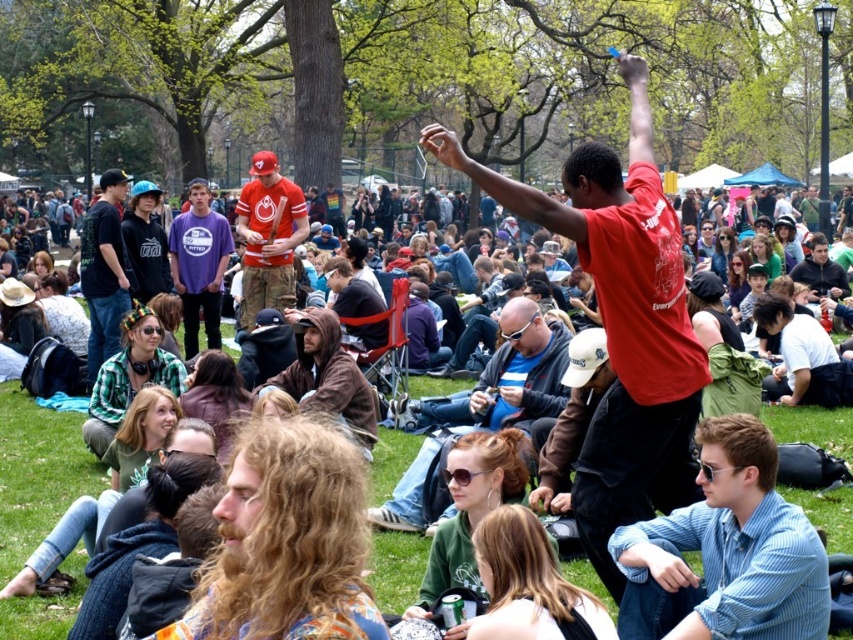
Can you confirm if matte brown leather jacket at center is thinner than matte black jacket at left?

Yes.

Measure the distance from matte brown leather jacket at center to matte black jacket at left.

A distance of 10.70 meters exists between matte brown leather jacket at center and matte black jacket at left.

Find the location of a particular element. This screenshot has height=640, width=853. matte brown leather jacket at center is located at coordinates (520, 371).

Find the location of a particular element. matte brown leather jacket at center is located at coordinates (520, 371).

Does matte brown leather jacket at center appear under purple cotton shirt at center?

Indeed, matte brown leather jacket at center is positioned under purple cotton shirt at center.

Which is more to the left, matte brown leather jacket at center or purple cotton shirt at center?

purple cotton shirt at center is more to the left.

Identify the location of matte brown leather jacket at center. (520, 371).

Image resolution: width=853 pixels, height=640 pixels. I want to click on matte brown leather jacket at center, so click(520, 371).

Is matte red shirt at center shorter than matte brown leather jacket at center?

No.

What do you see at coordinates (619, 323) in the screenshot? I see `matte red shirt at center` at bounding box center [619, 323].

This screenshot has width=853, height=640. I want to click on matte red shirt at center, so click(619, 323).